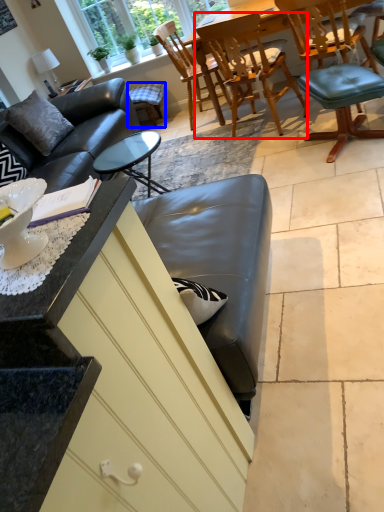
Question: Which of the following is the closest to the observer, chair (highlighted by a red box) or bar stool (highlighted by a blue box)?

Choices:
 (A) chair
 (B) bar stool

Answer: (A)